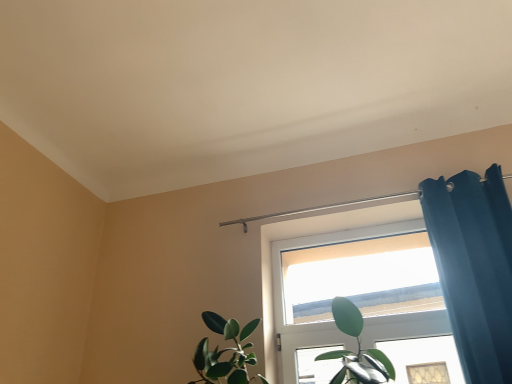
Measure the distance between teal velvet curtain at right and camera.

teal velvet curtain at right is 1.70 meters from camera.

The height and width of the screenshot is (384, 512). What do you see at coordinates (474, 267) in the screenshot? I see `teal velvet curtain at right` at bounding box center [474, 267].

I want to click on teal velvet curtain at right, so click(474, 267).

The image size is (512, 384). In order to click on white matte window at upper center in this screenshot , I will do `click(362, 278)`.

What do you see at coordinates (362, 278) in the screenshot? The image size is (512, 384). I see `white matte window at upper center` at bounding box center [362, 278].

Where is `teal velvet curtain at right`? Image resolution: width=512 pixels, height=384 pixels. teal velvet curtain at right is located at coordinates (474, 267).

Looking at this image, can you confirm if white matte window at upper center is positioned to the right of teal velvet curtain at right?

No, white matte window at upper center is not to the right of teal velvet curtain at right.

Is white matte window at upper center further to the viewer compared to teal velvet curtain at right?

Yes, it is.

Does point (393, 288) come farther from viewer compared to point (501, 233)?

Yes.

From the image's perspective, is white matte window at upper center located beneath teal velvet curtain at right?

Correct, white matte window at upper center appears lower than teal velvet curtain at right in the image.

From a real-world perspective, which is physically above, white matte window at upper center or teal velvet curtain at right?

white matte window at upper center, from a real-world perspective.

Considering the sizes of white matte window at upper center and teal velvet curtain at right in the image, is white matte window at upper center wider or thinner than teal velvet curtain at right?

Clearly, white matte window at upper center has less width compared to teal velvet curtain at right.

Is white matte window at upper center shorter than teal velvet curtain at right?

Yes.

Can you confirm if white matte window at upper center is bigger than teal velvet curtain at right?

Actually, white matte window at upper center might be smaller than teal velvet curtain at right.

Which is correct: white matte window at upper center is inside teal velvet curtain at right, or outside of it?

white matte window at upper center cannot be found inside teal velvet curtain at right.

Would you consider white matte window at upper center to be distant from teal velvet curtain at right?

No, white matte window at upper center is in close proximity to teal velvet curtain at right.

Is white matte window at upper center aimed at teal velvet curtain at right?

No, white matte window at upper center does not turn towards teal velvet curtain at right.

What's the angular difference between white matte window at upper center and teal velvet curtain at right's facing directions?

There is a 0.189-degree angle between the facing directions of white matte window at upper center and teal velvet curtain at right.

Locate an element on the screen. Image resolution: width=512 pixels, height=384 pixels. window below the teal velvet curtain at right (from the image's perspective) is located at coordinates (362, 278).

Between teal velvet curtain at right and white matte window at upper center, which one appears on the right side from the viewer's perspective?

teal velvet curtain at right is more to the right.

Is teal velvet curtain at right further to camera compared to white matte window at upper center?

That is False.

Which is more distant, (424, 190) or (382, 268)?

The point (382, 268) is farther from the camera.

From the image's perspective, is teal velvet curtain at right located above or below white matte window at upper center?

Clearly, from the image's perspective, teal velvet curtain at right is above white matte window at upper center.

From a real-world perspective, is teal velvet curtain at right on white matte window at upper center?

No, from a real-world perspective, teal velvet curtain at right is not on top of white matte window at upper center.

Is teal velvet curtain at right thinner than white matte window at upper center?

In fact, teal velvet curtain at right might be wider than white matte window at upper center.

Who is shorter, teal velvet curtain at right or white matte window at upper center?

white matte window at upper center.

In the scene shown: Is teal velvet curtain at right smaller than white matte window at upper center?

Actually, teal velvet curtain at right might be larger than white matte window at upper center.

Consider the image. Can white matte window at upper center be found inside teal velvet curtain at right?

No, white matte window at upper center is not surrounded by teal velvet curtain at right.

Is teal velvet curtain at right touching white matte window at upper center?

There is a gap between teal velvet curtain at right and white matte window at upper center.

Looking at this image, is teal velvet curtain at right looking in the opposite direction of white matte window at upper center?

No, teal velvet curtain at right is not facing away from white matte window at upper center.

How different are the orientations of teal velvet curtain at right and white matte window at upper center in degrees?

They differ by 0.189 degrees in their facing directions.

You are a GUI agent. You are given a task and a screenshot of the screen. Output one action in this format:
    pyautogui.click(x=<x>, y=<y>)
    Task: Click on the shower curtain in front of the white matte window at upper center
    This screenshot has height=384, width=512.
    Given the screenshot: What is the action you would take?
    click(474, 267)

Identify the location of shower curtain beneath the white matte window at upper center (from a real-world perspective). (474, 267).

Where is `window that appears on the left of teal velvet curtain at right`? The width and height of the screenshot is (512, 384). window that appears on the left of teal velvet curtain at right is located at coordinates (362, 278).